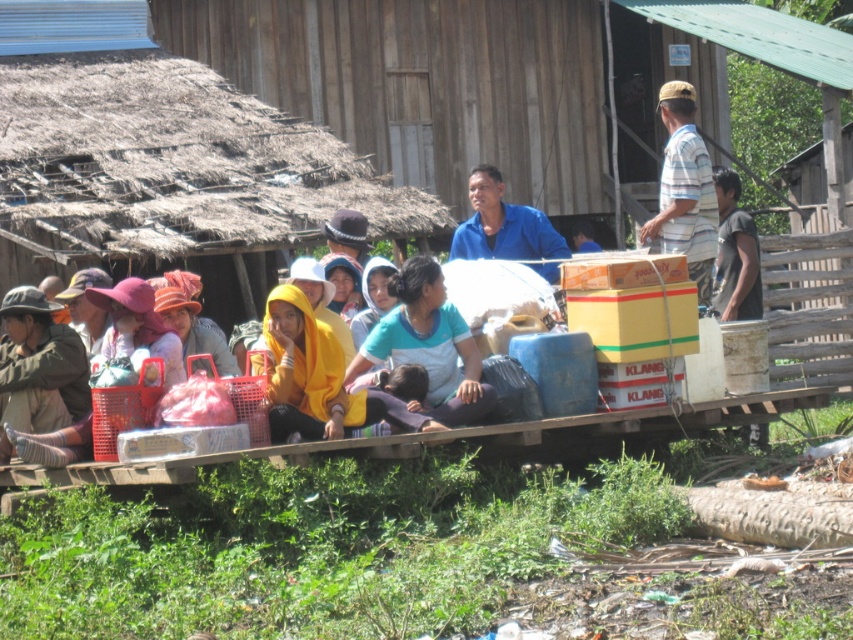
Consider the image. Who is lower down, blue matte shirt at center or dark gray t-shirt at right?

dark gray t-shirt at right is below.

Can you confirm if blue matte shirt at center is taller than dark gray t-shirt at right?

No, blue matte shirt at center is not taller than dark gray t-shirt at right.

Is point (457, 243) behind point (730, 317)?

No, it is in front of (730, 317).

Identify the location of blue matte shirt at center. (503, 225).

Does white striped shirt at upper right appear on the left side of blue fabric bag at center?

In fact, white striped shirt at upper right is to the right of blue fabric bag at center.

From the picture: Can you confirm if white striped shirt at upper right is positioned below blue fabric bag at center?

Actually, white striped shirt at upper right is above blue fabric bag at center.

Measure the distance between point (682, 115) and camera.

They are 17.99 meters apart.

This screenshot has width=853, height=640. In order to click on white striped shirt at upper right in this screenshot , I will do [683, 189].

Which is below, light blue cotton shirt at center or white striped shirt at upper right?

Positioned lower is light blue cotton shirt at center.

Does point (477, 401) come closer to viewer compared to point (671, 150)?

Yes, point (477, 401) is in front of point (671, 150).

Where is `light blue cotton shirt at center`? The width and height of the screenshot is (853, 640). light blue cotton shirt at center is located at coordinates (428, 346).